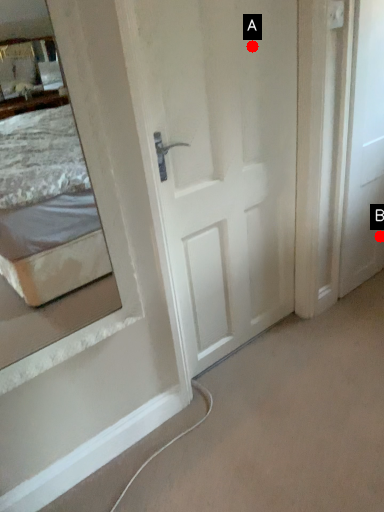
Question: Two points are circled on the image, labeled by A and B beside each circle. Which of the following is the farthest from the observer?

Choices:
 (A) A is further
 (B) B is further

Answer: (B)